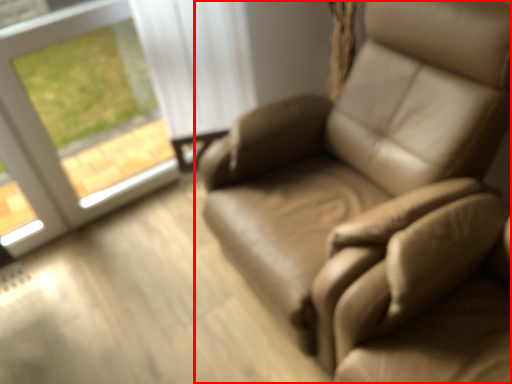
Question: From the image's perspective, where is chair (annotated by the red box) located in relation to window in the image?

Choices:
 (A) below
 (B) above

Answer: (A)